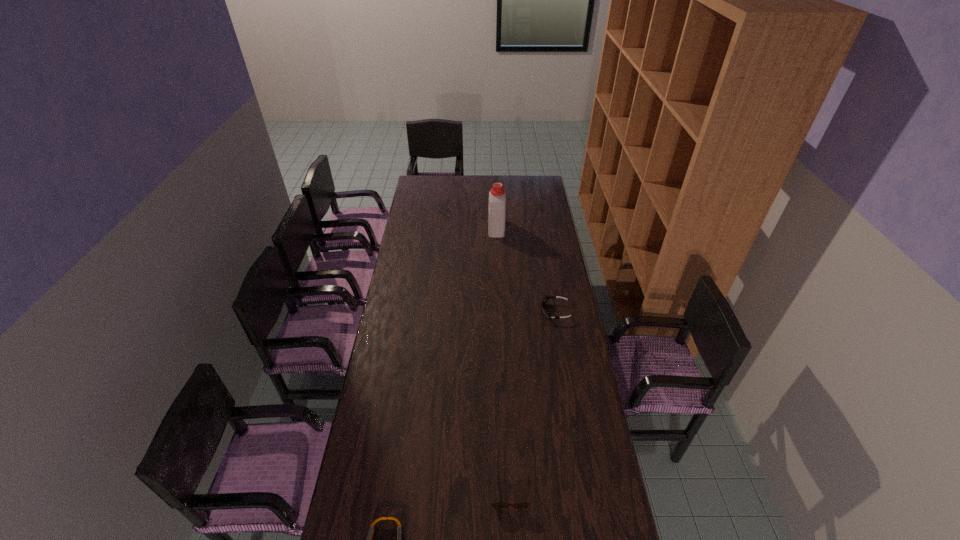
Find the location of a particular element. The height and width of the screenshot is (540, 960). vacant space in between the detergent and the rightmost object is located at coordinates (526, 270).

The height and width of the screenshot is (540, 960). In order to click on object that is the third closest to the spectacles in this screenshot , I will do `click(497, 196)`.

Select which object is the second closest to the spectacles. Please provide its 2D coordinates. Your answer should be formatted as a tuple, i.e. [(x, y)], where the tuple contains the x and y coordinates of a point satisfying the conditions above.

[(545, 299)]

This screenshot has height=540, width=960. Find the location of `free space that satisfies the following two spatial constraints: 1. on the front and sides of the right goggles; 2. at the front view of the spectacles`. free space that satisfies the following two spatial constraints: 1. on the front and sides of the right goggles; 2. at the front view of the spectacles is located at coordinates (588, 492).

Find the location of a particular element. The height and width of the screenshot is (540, 960). free space that satisfies the following two spatial constraints: 1. on the front and sides of the farther goggles; 2. at the front view of the spectacles is located at coordinates (588, 492).